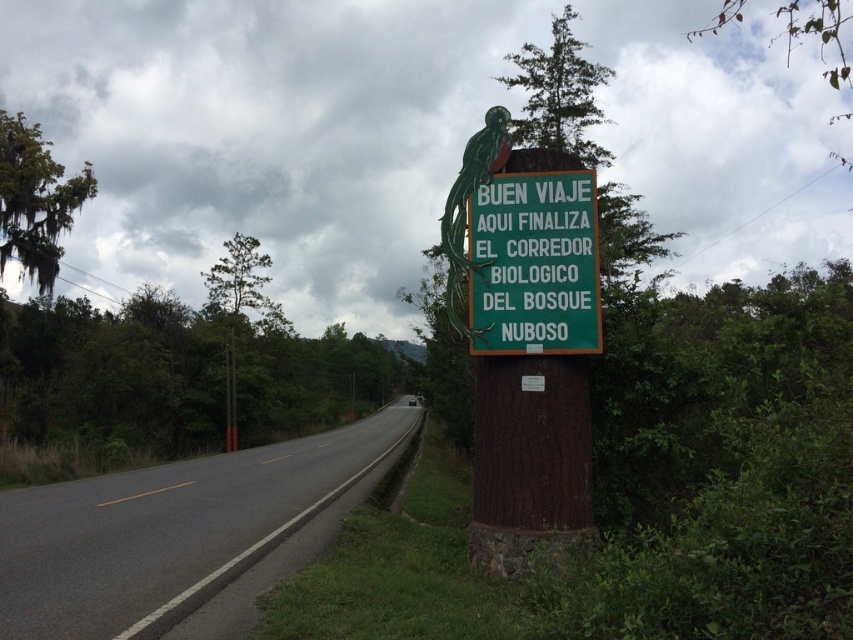
You are driving a car and see the asphalt road at center and the green matte sign at center. Which object is closer to you?

The asphalt road at center is closer to you because it is in front of the green matte sign at center.

You are standing on the side of the road and want to cross the asphalt road at center. The road is 5 meters wide. Can you safely cross it without stepping into the road?

The asphalt road at center and viewer are 5.89 meters apart from each other. Since the road is 5 meters wide, the distance between you and the road is sufficient to safely cross without stepping onto the road.

You are a driver approaching the green matte sign at center and the asphalt road at center. Which object is closer to your right side as you drive forward?

The green matte sign at center is closer to your right side because the asphalt road at center is to the left of it.